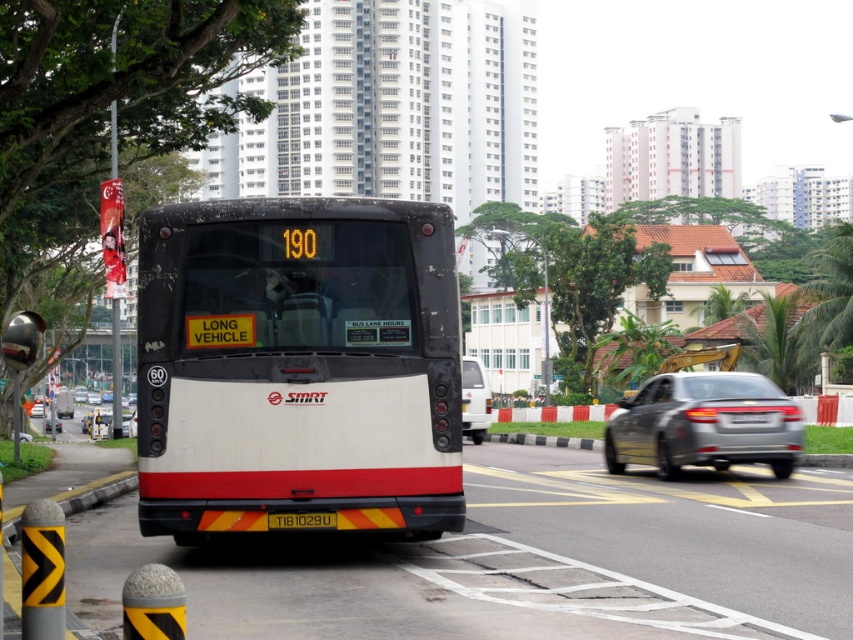
Question: Does white matte van at center lie behind yellowtexturedlicense plate at center?

Choices:
 (A) no
 (B) yes

Answer: (B)

Question: Is the position of white matte bus at center more distant than that of yellowtexturedlicense plate at center?

Choices:
 (A) yes
 (B) no

Answer: (B)

Question: Which object is the farthest from the yellowtexturedlicense plate at center?

Choices:
 (A) white matte van at center
 (B) white matte bus at center

Answer: (A)

Question: Can you confirm if white matte bus at center is wider than white matte van at center?

Choices:
 (A) yes
 (B) no

Answer: (A)

Question: Among these objects, which one is nearest to the camera?

Choices:
 (A) white matte bus at center
 (B) silver metallic sedan at center-right
 (C) white matte van at center
 (D) yellowtexturedlicense plate at center

Answer: (A)

Question: Which object is the closest to the yellowtexturedlicense plate at center?

Choices:
 (A) white matte van at center
 (B) white matte bus at center
 (C) silver metallic sedan at center-right

Answer: (B)